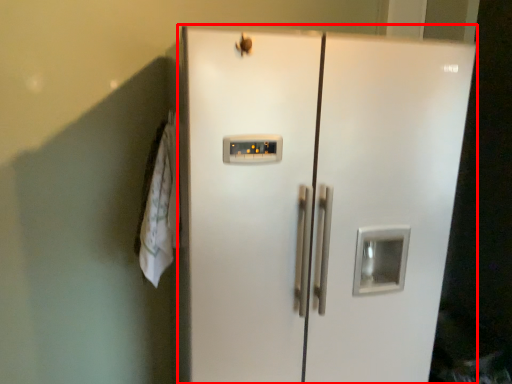
Question: From the image's perspective, where is refrigerator (annotated by the red box) located in relation to laundry in the image?

Choices:
 (A) above
 (B) below

Answer: (B)